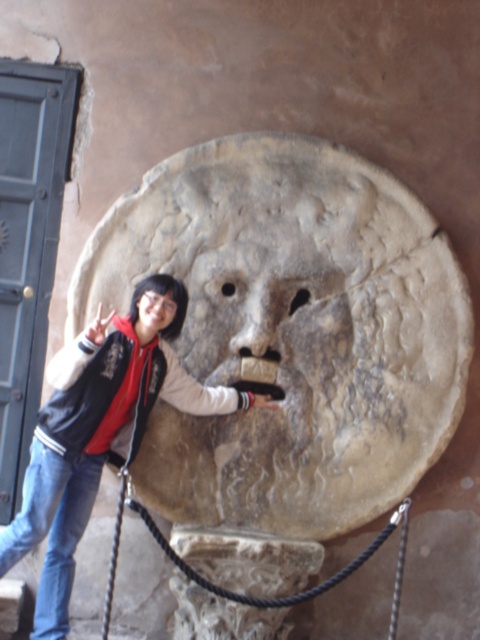
You are standing in front of the sculpture and want to place a small flower at the point closer to you between point (56, 522) and point (147, 332). Which point should you choose?

Point (56, 522) is in front of point (147, 332), so you should choose point (56, 522) to place the flower closer to you.

Based on the scene description, where is the jeans at lower left located in terms of coordinates?

The jeans at lower left are located at coordinates point [97,435].

You are an art student analyzing the sculpture in the scene. You notice two versions of the stone face labeled as gray stone face at center and matte stone face at center. Which one do you think is taller?

The gray stone face at center is much taller than the matte stone face at center.